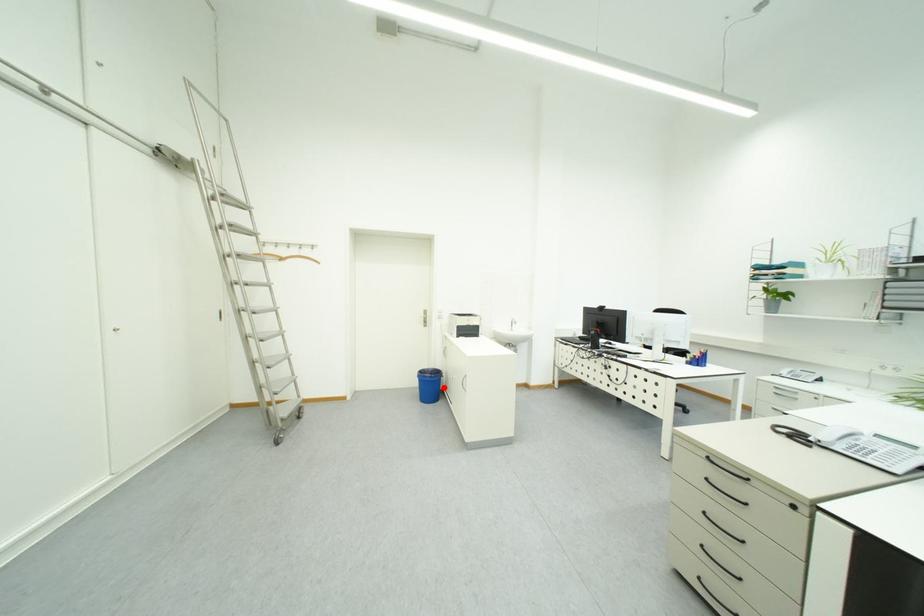
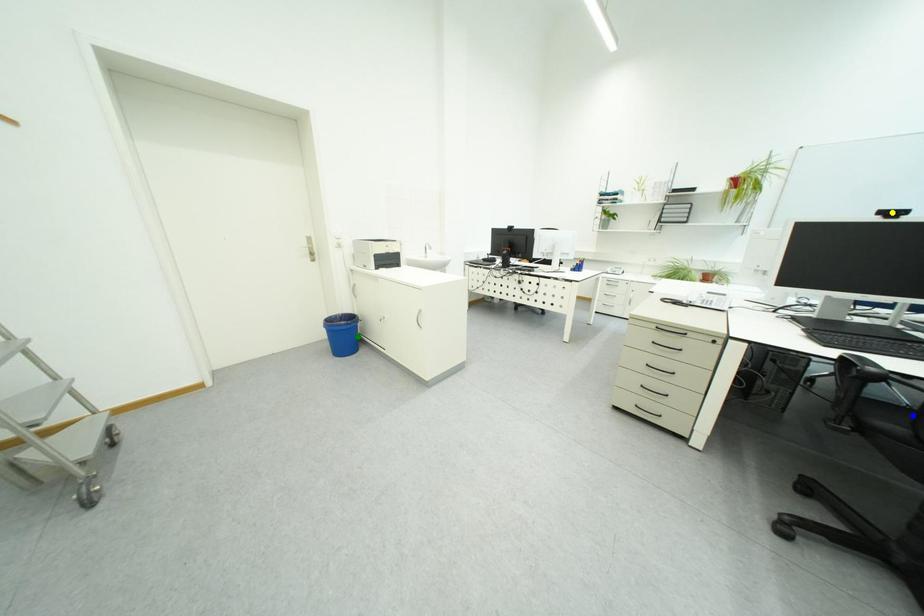
Question: I am providing you with two images of the same scene from different viewpoints. A red point is marked on the first image. You are given multiple points on the second image. Can you choose the point in image 2 that corresponds to the point in image 1?

Choices:
 (A) yellow point
 (B) green point
 (C) blue point

Answer: (B)